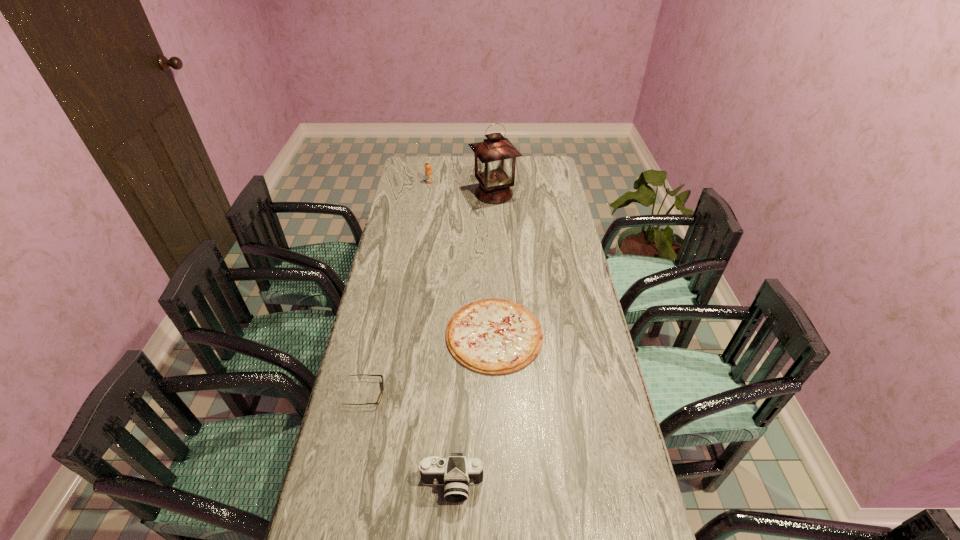
Locate an element on the screen. This screenshot has height=540, width=960. vacant space that satisfies the following two spatial constraints: 1. on the back side of the nearest object; 2. on the front-facing side of the second nearest object is located at coordinates (456, 393).

Where is `vacant space that satisfies the following two spatial constraints: 1. on the front label of the nearest object; 2. on the left side of the fourth object from right to left`? vacant space that satisfies the following two spatial constraints: 1. on the front label of the nearest object; 2. on the left side of the fourth object from right to left is located at coordinates (381, 485).

This screenshot has height=540, width=960. In order to click on vacant point that satisfies the following two spatial constraints: 1. on the front-facing side of the fourth tallest object; 2. on the right side of the nearest object in this screenshot , I will do `click(346, 485)`.